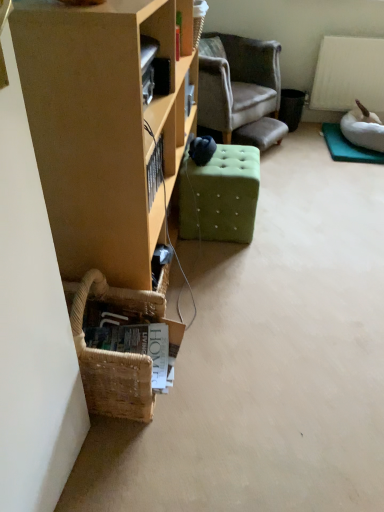
Where is `vacant area that is situated to the right of woven brown basket at lower left`? The height and width of the screenshot is (512, 384). vacant area that is situated to the right of woven brown basket at lower left is located at coordinates (218, 383).